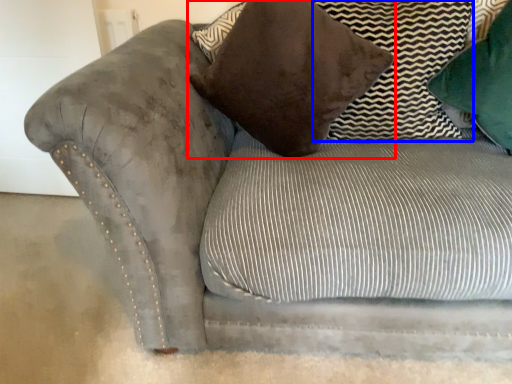
Question: Among these objects, which one is farthest to the camera, pillow (highlighted by a red box) or pillow (highlighted by a blue box)?

Choices:
 (A) pillow
 (B) pillow

Answer: (B)